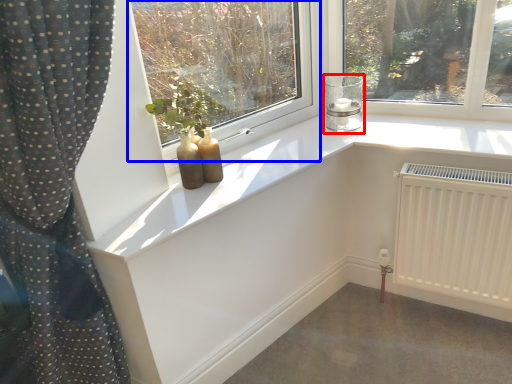
Question: Which of the following is the farthest to the observer, candle holder (highlighted by a red box) or window (highlighted by a blue box)?

Choices:
 (A) candle holder
 (B) window

Answer: (A)